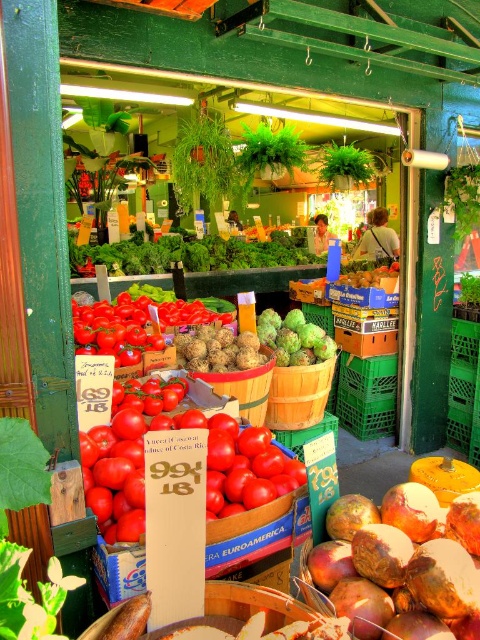
You are a customer at the market and want to know which item is taller between the green leafy at center and the green matte pineapple at center. Can you tell me which one is taller?

The green leafy at center is taller than the green matte pineapple at center.

You are a customer at the market and want to locate the rustic brown root at center. Which part of the image should you look at?

The rustic brown root at center is located at point coordinates of (403, 564).

You are a customer at the market and want to pick up both the green leafy at center and the green matte pineapple at center. Which item is closer to you?

The green leafy at center is closer to you because the green matte pineapple at center is behind it.